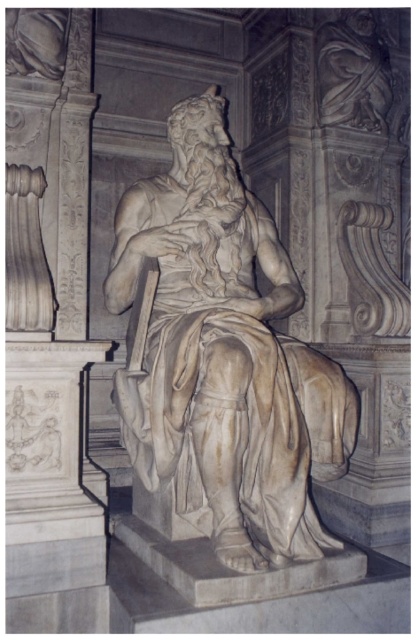
Does white marble statue at center appear on the left side of marble carving at upper center?

Yes, white marble statue at center is to the left of marble carving at upper center.

Is white marble statue at center smaller than marble carving at upper center?

Incorrect, white marble statue at center is not smaller in size than marble carving at upper center.

In order to click on white marble statue at center in this screenshot , I will do `click(224, 356)`.